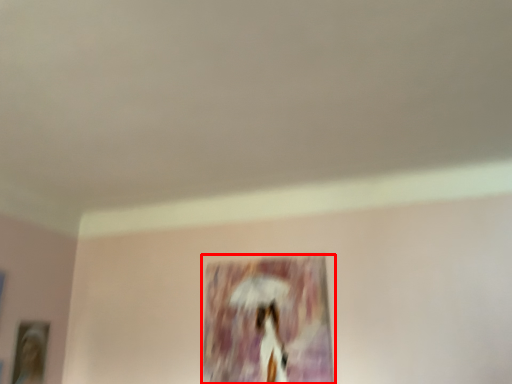
Question: Considering the relative positions of picture frame (annotated by the red box) and picture frame in the image provided, where is picture frame (annotated by the red box) located with respect to the staircase?

Choices:
 (A) left
 (B) right

Answer: (B)